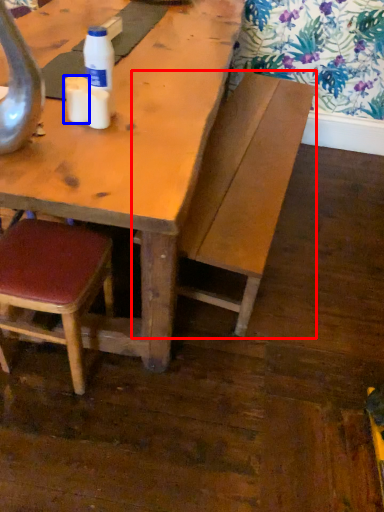
Question: Which point is closer to the camera, bench (highlighted by a red box) or coffee cup (highlighted by a blue box)?

Choices:
 (A) bench
 (B) coffee cup

Answer: (B)